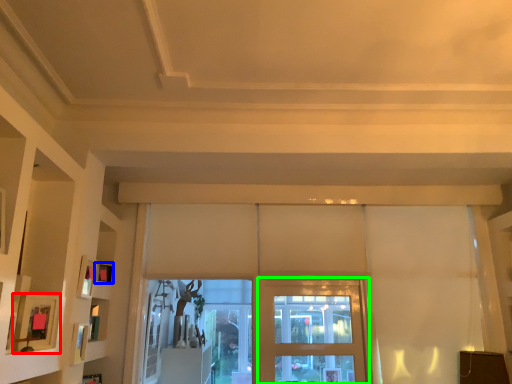
Question: Based on their relative distances, which object is farther from picture frame (highlighted by a red box)? Choose from picture frame (highlighted by a blue box) and screen door (highlighted by a green box).

Choices:
 (A) picture frame
 (B) screen door

Answer: (B)